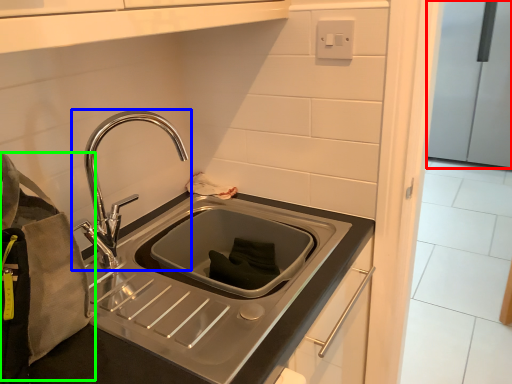
Question: Which is nearer to the appliance (highlighted by a red box)? tap (highlighted by a blue box) or pouch (highlighted by a green box).

Choices:
 (A) tap
 (B) pouch

Answer: (A)